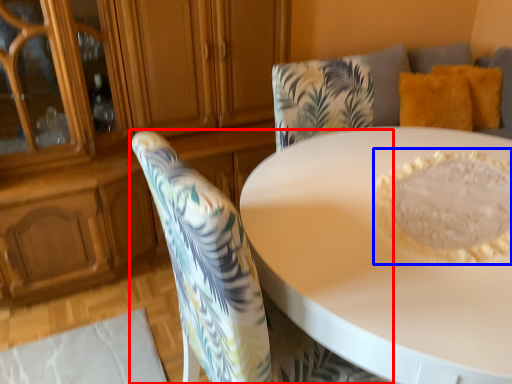
Question: Which object appears closest to the camera in this image, chair (highlighted by a red box) or food (highlighted by a blue box)?

Choices:
 (A) chair
 (B) food

Answer: (A)